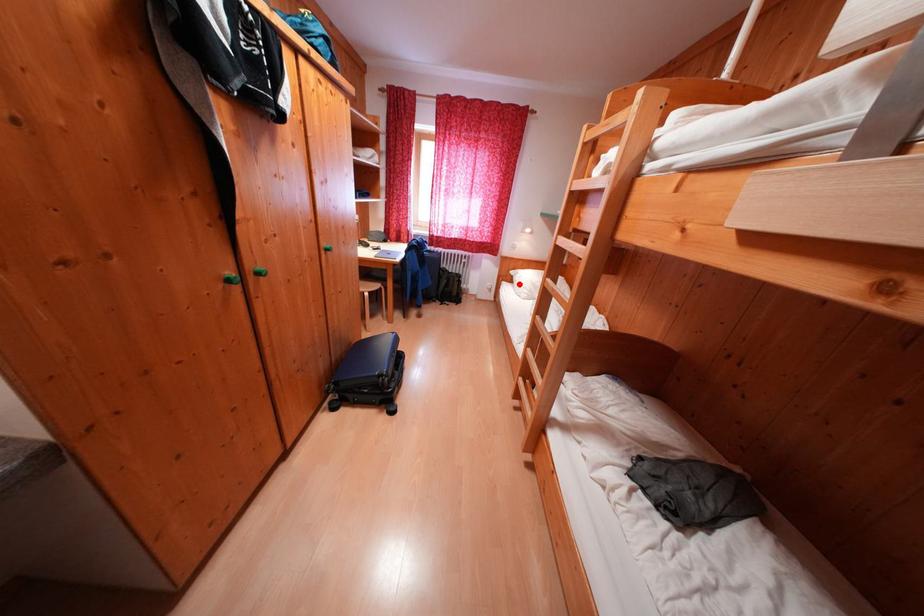
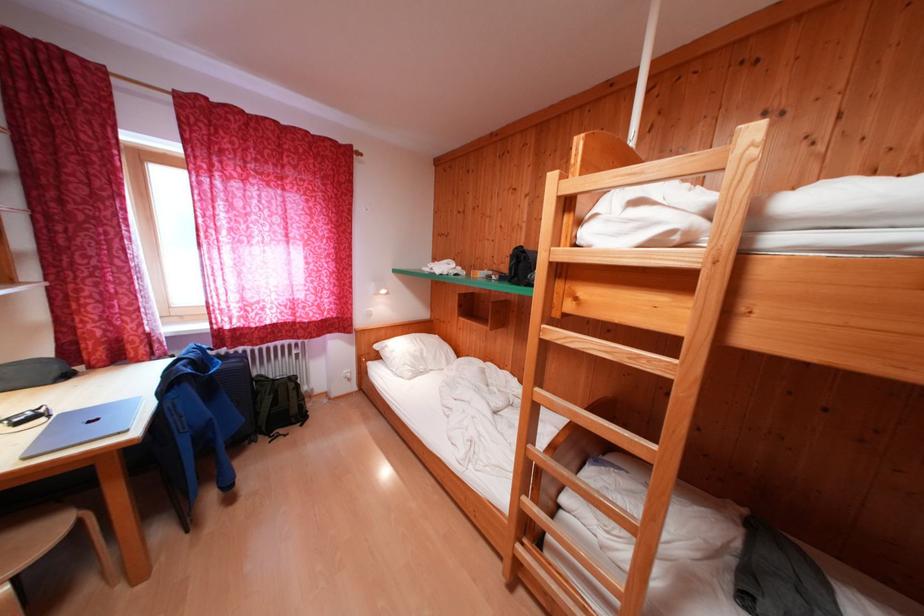
In the second image, find the point that corresponds to the highlighted location in the first image.

(385, 361)